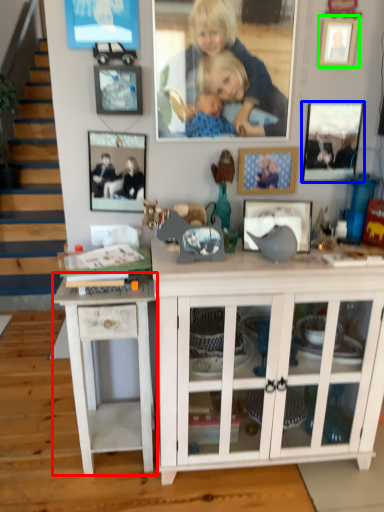
Question: Estimate the real-world distances between objects in this image. Which object is closer to table (highlighted by a red box), picture frame (highlighted by a blue box) or picture frame (highlighted by a green box)?

Choices:
 (A) picture frame
 (B) picture frame

Answer: (A)